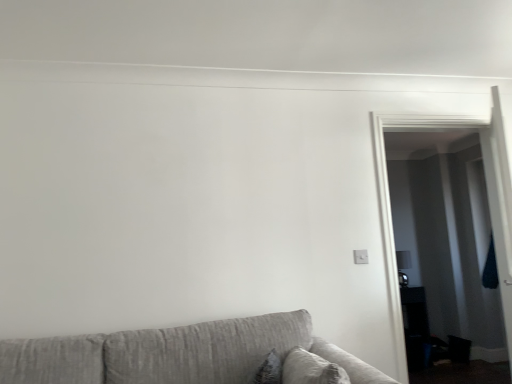
What do you see at coordinates (188, 355) in the screenshot? I see `textured gray couch at lower left` at bounding box center [188, 355].

The height and width of the screenshot is (384, 512). I want to click on textured gray couch at lower left, so click(x=188, y=355).

I want to click on transparent glass door at right, so pyautogui.click(x=390, y=203).

This screenshot has height=384, width=512. Describe the element at coordinates (390, 203) in the screenshot. I see `transparent glass door at right` at that location.

Measure the distance between transparent glass door at right and camera.

8.05 feet.

Identify the location of textured gray couch at lower left. This screenshot has height=384, width=512. (188, 355).

Visually, is transparent glass door at right positioned to the left or to the right of textured gray couch at lower left?

In the image, transparent glass door at right appears on the right side of textured gray couch at lower left.

Considering their positions, is transparent glass door at right located in front of or behind textured gray couch at lower left?

transparent glass door at right is positioned farther from the viewer than textured gray couch at lower left.

Which point is more forward, [390,218] or [302,326]?

Point [302,326]

From the image's perspective, is transparent glass door at right positioned above or below textured gray couch at lower left?

transparent glass door at right is situated higher than textured gray couch at lower left in the image.

Based on the photo, from a real-world perspective, which is physically above, transparent glass door at right or textured gray couch at lower left?

In real-world perspective, transparent glass door at right is above.

Considering the sizes of transparent glass door at right and textured gray couch at lower left in the image, is transparent glass door at right wider or thinner than textured gray couch at lower left?

Clearly, transparent glass door at right has less width compared to textured gray couch at lower left.

Which of these two, transparent glass door at right or textured gray couch at lower left, stands taller?

transparent glass door at right.

Can you confirm if transparent glass door at right is smaller than textured gray couch at lower left?

Yes, transparent glass door at right is smaller than textured gray couch at lower left.

Do you think transparent glass door at right is within textured gray couch at lower left, or outside of it?

transparent glass door at right lies outside textured gray couch at lower left.

Can you see transparent glass door at right touching textured gray couch at lower left?

No, transparent glass door at right is not beside textured gray couch at lower left.

Is transparent glass door at right oriented towards textured gray couch at lower left?

No.

How different are the orientations of transparent glass door at right and textured gray couch at lower left in degrees?

The facing directions of transparent glass door at right and textured gray couch at lower left are 0.455 degrees apart.

Locate an element on the screen. glass door behind the textured gray couch at lower left is located at coordinates (390, 203).

Considering the relative positions of textured gray couch at lower left and transparent glass door at right in the image provided, is textured gray couch at lower left to the right of transparent glass door at right from the viewer's perspective?

In fact, textured gray couch at lower left is to the left of transparent glass door at right.

Is textured gray couch at lower left behind transparent glass door at right?

No, textured gray couch at lower left is in front of transparent glass door at right.

Between point (1, 347) and point (375, 117), which one is positioned in front?

The point (1, 347) is closer to the camera.

From the image's perspective, who appears lower, textured gray couch at lower left or transparent glass door at right?

textured gray couch at lower left appears lower in the image.

From a real-world perspective, is textured gray couch at lower left beneath transparent glass door at right?

Yes.

Which of these two, textured gray couch at lower left or transparent glass door at right, is wider?

textured gray couch at lower left is wider.

Is textured gray couch at lower left taller or shorter than transparent glass door at right?

In the image, textured gray couch at lower left appears to be shorter than transparent glass door at right.

Between textured gray couch at lower left and transparent glass door at right, which one has larger size?

With larger size is textured gray couch at lower left.

From the picture: Is textured gray couch at lower left inside or outside of transparent glass door at right?

textured gray couch at lower left is spatially situated outside transparent glass door at right.

Is textured gray couch at lower left in contact with transparent glass door at right?

No.

Is textured gray couch at lower left oriented towards transparent glass door at right?

No, textured gray couch at lower left is not turned towards transparent glass door at right.

Consider the image. How far apart are textured gray couch at lower left and transparent glass door at right?

They are 3.85 feet apart.

Locate an element on the screen. glass door above the textured gray couch at lower left (from the image's perspective) is located at coordinates (390, 203).

I want to click on studio couch located below the transparent glass door at right (from the image's perspective), so click(188, 355).

You are a GUI agent. You are given a task and a screenshot of the screen. Output one action in this format:
    pyautogui.click(x=<x>, y=<y>)
    Task: Click on the glass door located above the textured gray couch at lower left (from a real-world perspective)
    The image size is (512, 384).
    Given the screenshot: What is the action you would take?
    pyautogui.click(x=390, y=203)